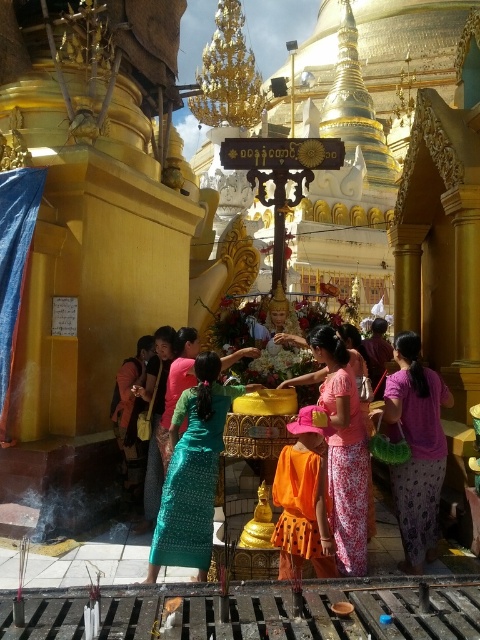
Question: Which is farther from the pink fabric dress at center?

Choices:
 (A) pink printed fabric at center
 (B) pink fabric skirt at lower right
 (C) orange fabric robe at center

Answer: (C)

Question: Estimate the real-world distances between objects in this image. Which object is closer to the green silk dress at center?

Choices:
 (A) pink printed fabric at center
 (B) pink fabric skirt at lower right
 (C) orange fabric robe at center
 (D) teal silk robe at center

Answer: (D)

Question: Does teal silk robe at center have a greater width compared to orange fabric robe at center?

Choices:
 (A) no
 (B) yes

Answer: (B)

Question: Is pink fabric dress at center thinner than teal silk robe at center?

Choices:
 (A) yes
 (B) no

Answer: (B)

Question: Is pink fabric skirt at lower right smaller than pink printed fabric at center?

Choices:
 (A) yes
 (B) no

Answer: (B)

Question: Which of these objects is positioned farthest from the teal silk robe at center?

Choices:
 (A) green silk dress at center
 (B) orange fabric robe at center
 (C) pink printed fabric at center

Answer: (A)